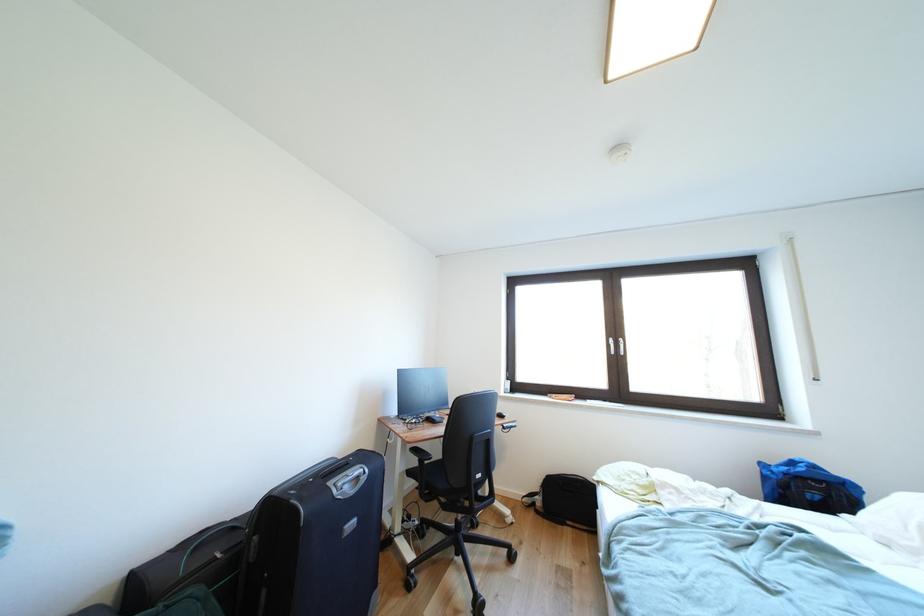
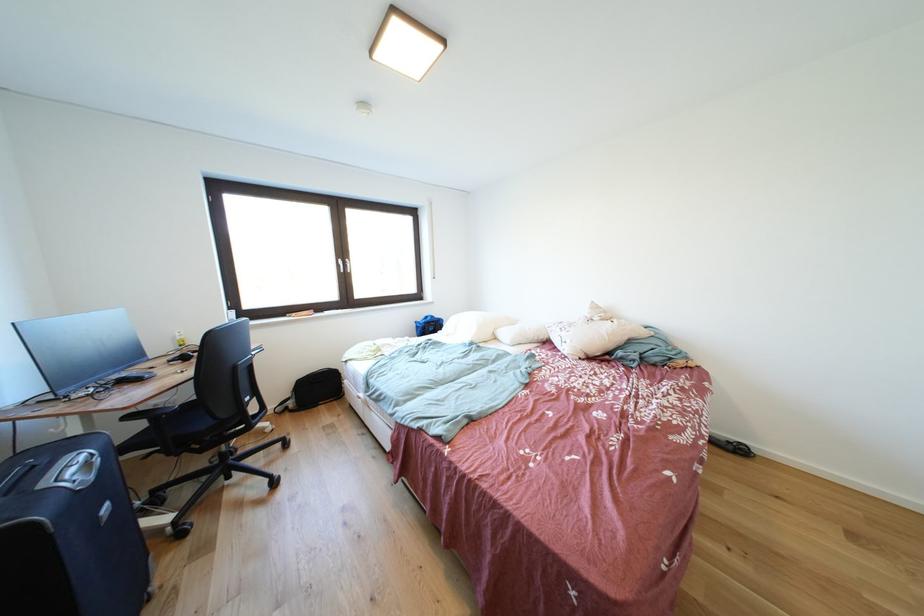
Where in the second image is the point corresponding to the point at 417,448 from the first image?

(134, 413)